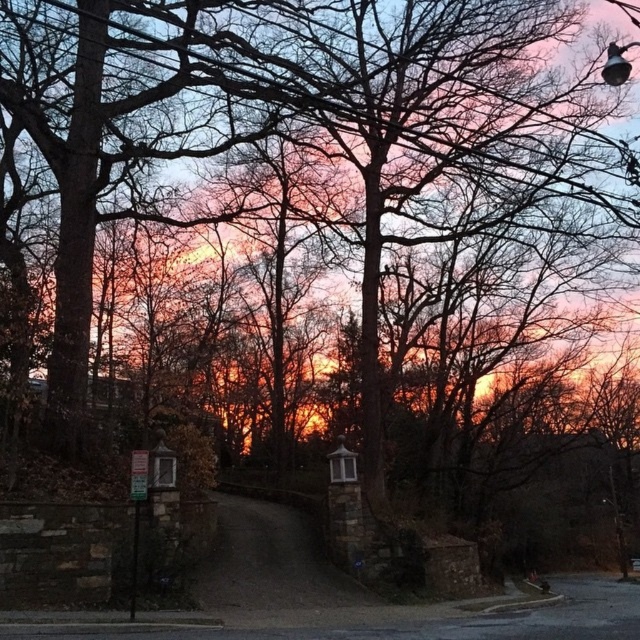
Question: Can you confirm if green plastic sign at lower left is positioned to the right of metallic pole at center?

Choices:
 (A) no
 (B) yes

Answer: (B)

Question: Which object appears farthest from the camera in this image?

Choices:
 (A) metallic pole at center
 (B) green plastic sign at lower left

Answer: (B)

Question: Can you confirm if green plastic sign at lower left is wider than metallic pole at center?

Choices:
 (A) yes
 (B) no

Answer: (B)

Question: Among these points, which one is nearest to the camera?

Choices:
 (A) (136, 573)
 (B) (145, 468)

Answer: (B)

Question: Is green plastic sign at lower left to the left of metallic pole at center from the viewer's perspective?

Choices:
 (A) yes
 (B) no

Answer: (B)